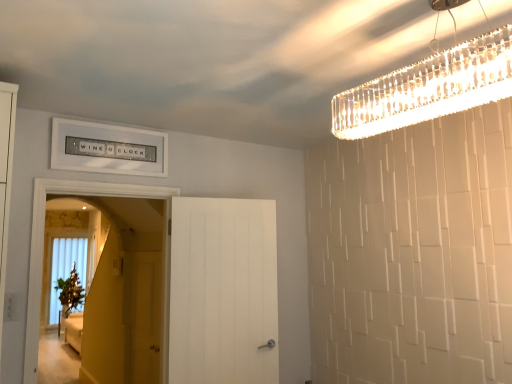
Question: Is white wooden door at left, the 2th door from the right, bigger or smaller than white matte door at center, positioned as the 1th door in right-to-left order?

Choices:
 (A) small
 (B) big

Answer: (B)

Question: Is white wooden door at left, which is counted as the 1th door, starting from the left, wider or thinner than white matte door at center, the 2th door positioned from the left?

Choices:
 (A) thin
 (B) wide

Answer: (B)

Question: Which object is positioned closest to the clear crystal chandelier at upper right?

Choices:
 (A) white matte door at center, positioned as the 1th door in right-to-left order
 (B) matte yellow screen door at center
 (C) white wooden door at left, the 2th door from the right

Answer: (A)

Question: Which is farther from the white matte door at center, the 2th door positioned from the left?

Choices:
 (A) matte yellow screen door at center
 (B) clear crystal chandelier at upper right
 (C) white wooden door at left, the 2th door from the right

Answer: (B)